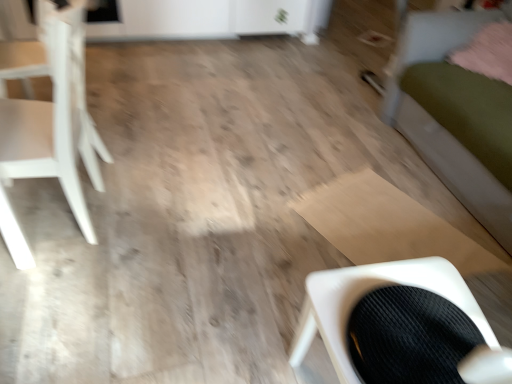
Identify the location of vacant space positioned to the left of green fabric bed at right. The width and height of the screenshot is (512, 384). (268, 147).